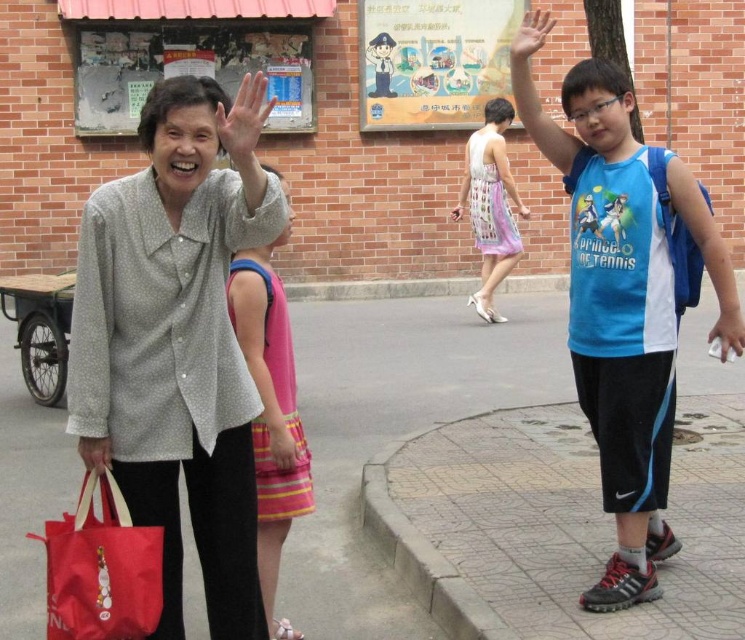
Is pastel floral dress at center further to the viewer compared to matte gray hand at upper left?

Yes, it is.

From the picture: Is pastel floral dress at center shorter than matte gray hand at upper left?

No.

Is point (475, 202) less distant than point (264, 96)?

No.

Where is `pastel floral dress at center`? pastel floral dress at center is located at coordinates (489, 204).

Which is more to the right, matte gray hand at upper left or matte red bag at lower left?

Positioned to the right is matte gray hand at upper left.

Locate an element on the screen. The width and height of the screenshot is (745, 640). matte gray hand at upper left is located at coordinates (244, 116).

Describe the element at coordinates (244, 116) in the screenshot. I see `matte gray hand at upper left` at that location.

Locate an element on the screen. Image resolution: width=745 pixels, height=640 pixels. matte gray hand at upper left is located at coordinates (244, 116).

Which is more to the left, scratched paperboard at upper left or pastel floral dress at center?

scratched paperboard at upper left is more to the left.

Between point (130, 124) and point (501, 273), which one is positioned behind?

Positioned behind is point (130, 124).

I want to click on scratched paperboard at upper left, so click(x=187, y=68).